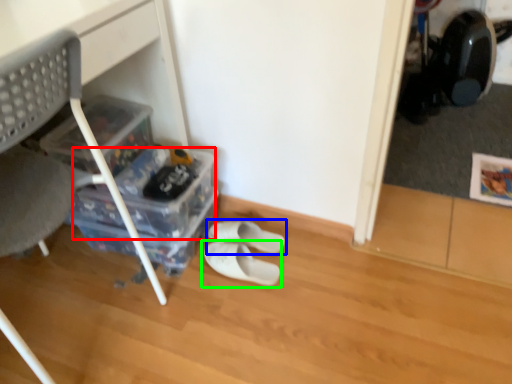
Question: Based on their relative distances, which object is farther from storage box (highlighted by a red box)? Choose from footwear (highlighted by a blue box) and footwear (highlighted by a green box).

Choices:
 (A) footwear
 (B) footwear

Answer: (B)